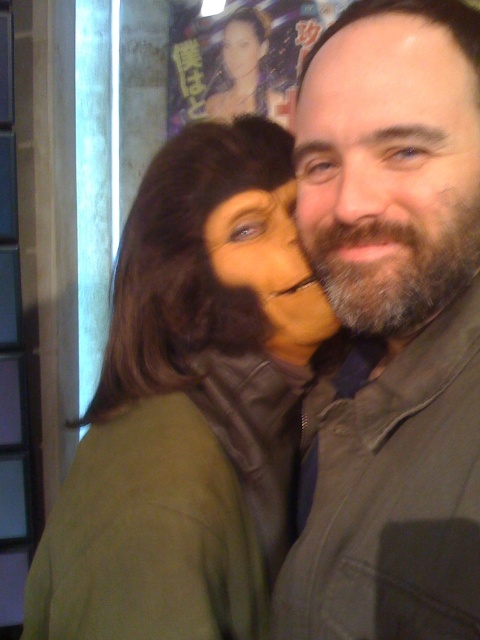
Question: Among these objects, which one is farthest from the camera?

Choices:
 (A) matte brown hair at center
 (B) matte black hair at center

Answer: (B)

Question: Does matte brown hair at center appear on the left side of smooth skin face at center?

Choices:
 (A) no
 (B) yes

Answer: (A)

Question: Which point is closer to the camera taking this photo?

Choices:
 (A) (260, 221)
 (B) (224, 108)
 (C) (322, 148)
 (D) (459, 282)

Answer: (D)

Question: Is matte brown hair at center to the right of smooth skin face at center from the viewer's perspective?

Choices:
 (A) no
 (B) yes

Answer: (B)

Question: Which of the following is the farthest from the observer?

Choices:
 (A) matte brown hair at center
 (B) bearded man at center

Answer: (A)

Question: Is green matte jacket at center to the right of bearded man at center from the viewer's perspective?

Choices:
 (A) yes
 (B) no

Answer: (B)